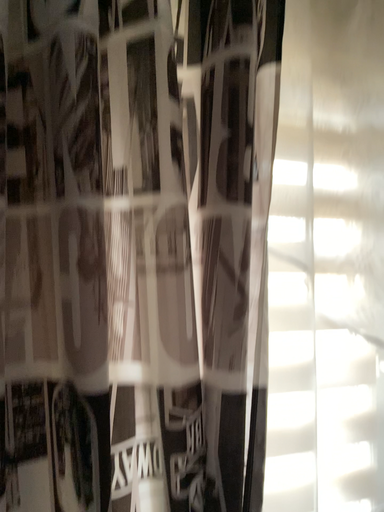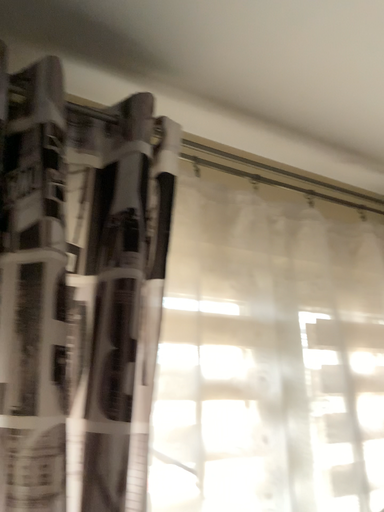
Question: How did the camera likely rotate when shooting the video?

Choices:
 (A) rotated upward
 (B) rotated downward

Answer: (A)